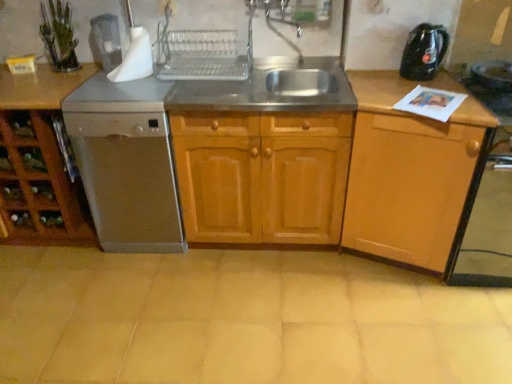
This screenshot has width=512, height=384. I want to click on free space above light brown wood cabinet at right, marked as the 1th cabinetry in a right-to-left arrangement (from a real-world perspective), so click(434, 94).